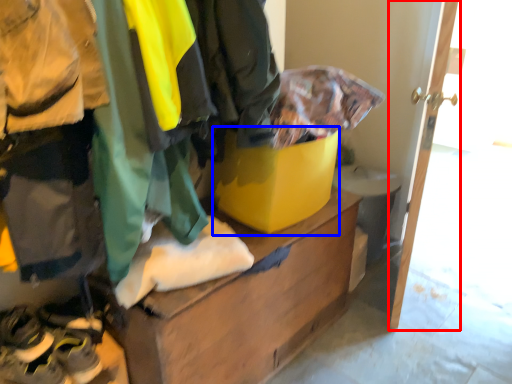
Question: Which object appears closest to the camera in this image, door (highlighted by a red box) or cardboard box (highlighted by a blue box)?

Choices:
 (A) door
 (B) cardboard box

Answer: (A)